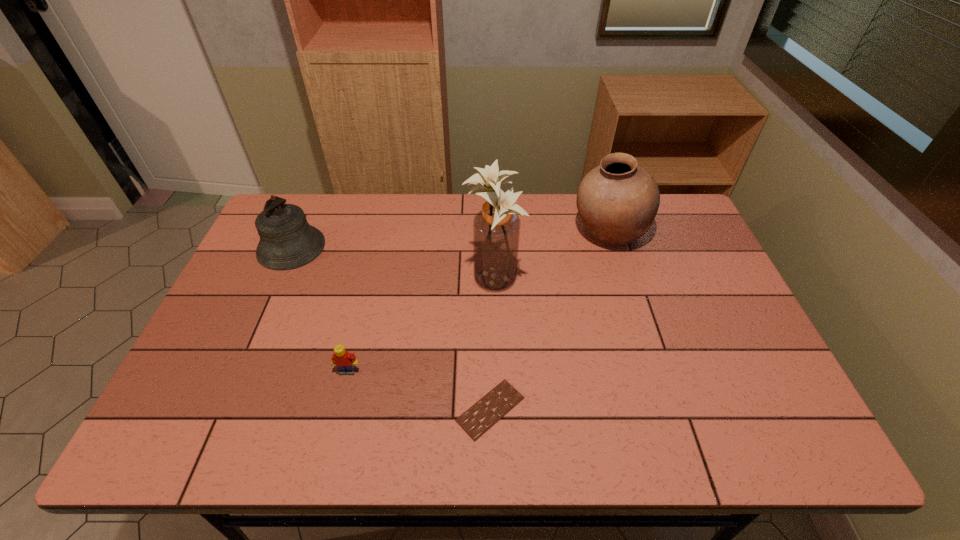
Where is `object positioned at the far right corner`? The width and height of the screenshot is (960, 540). object positioned at the far right corner is located at coordinates (617, 201).

The width and height of the screenshot is (960, 540). I want to click on free spot at the far edge of the desktop, so pyautogui.click(x=454, y=199).

The height and width of the screenshot is (540, 960). Identify the location of vacant space at the near edge of the desktop. (465, 442).

This screenshot has width=960, height=540. In the image, there is a desktop. Find the location of `vacant area at the left edge`. vacant area at the left edge is located at coordinates (253, 354).

Locate an element on the screen. vacant space at the right edge of the desktop is located at coordinates (693, 280).

You are a GUI agent. You are given a task and a screenshot of the screen. Output one action in this format:
    pyautogui.click(x=<x>, y=<y>)
    Task: Click on the free space between the rightmost object and the shortest object
    Image resolution: width=960 pixels, height=540 pixels.
    Given the screenshot: What is the action you would take?
    pyautogui.click(x=550, y=321)

Find the location of a particular element. free space between the shortest object and the pottery is located at coordinates (550, 321).

This screenshot has width=960, height=540. In order to click on vacant space that's between the fourth object from right to left and the rightmost object in this screenshot , I will do `click(479, 302)`.

Where is `vacant region between the flower arrangement and the bell`? This screenshot has width=960, height=540. vacant region between the flower arrangement and the bell is located at coordinates (393, 264).

The width and height of the screenshot is (960, 540). Identify the location of blank region between the chocolate bar and the second tallest object. (550, 321).